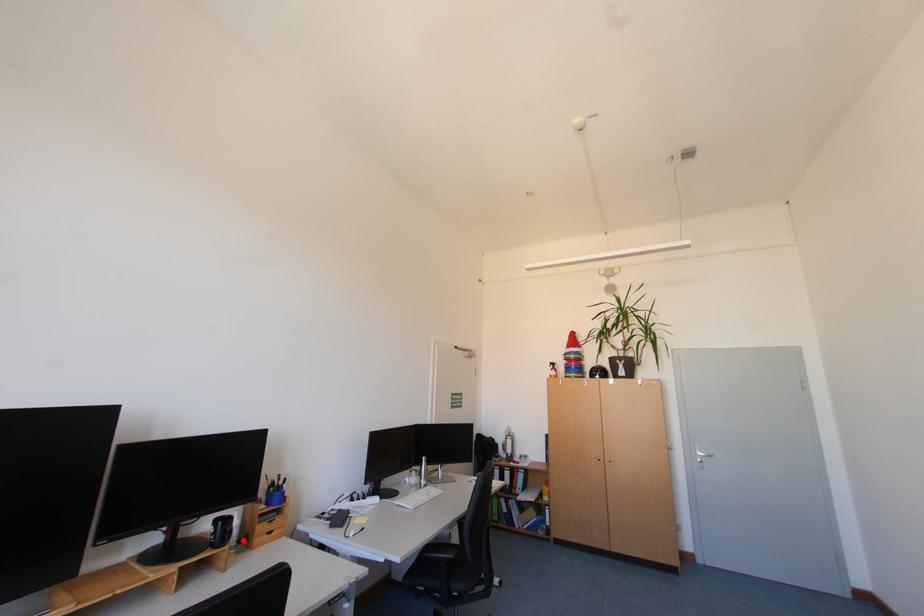
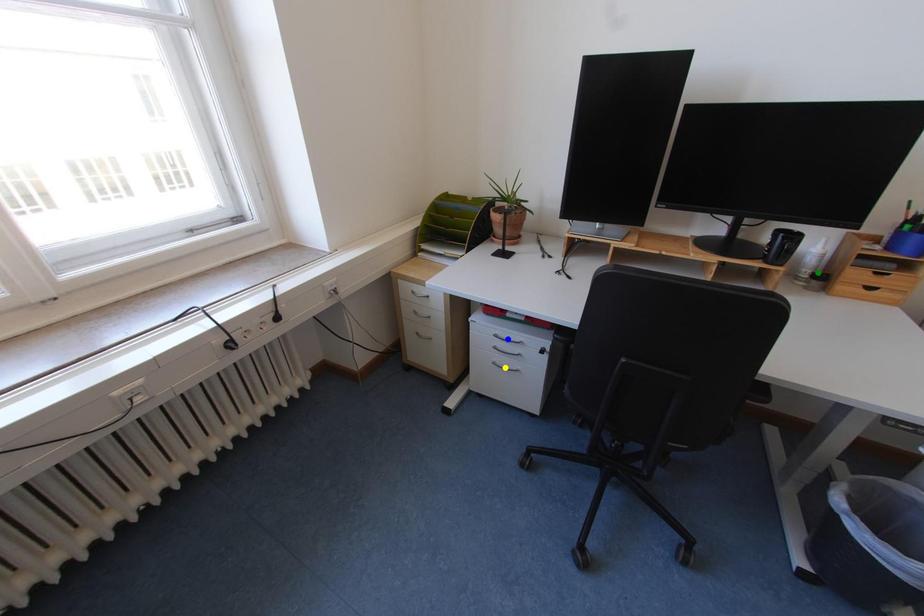
Question: I am providing you with two images of the same scene from different viewpoints. A red point is marked on the first image. You are given multiple points on the second image. Which mark in image 2 goes with the point in image 1?

Choices:
 (A) yellow point
 (B) green point
 (C) blue point

Answer: (B)